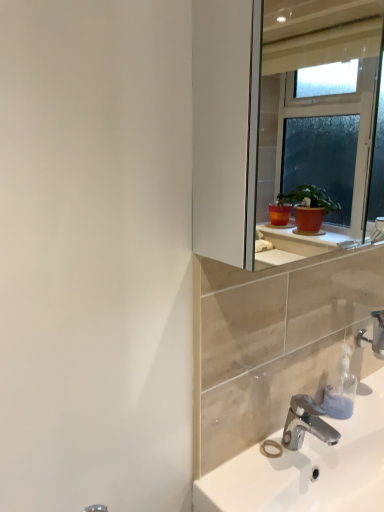
At what (x,y) coordinates should I click in order to perform the action: click on free space to the left of chrome metallic faucet at lower right, which ranks as the second tap in right-to-left order. Please return your answer as a coordinate pair (x, y). The width and height of the screenshot is (384, 512). Looking at the image, I should click on (252, 473).